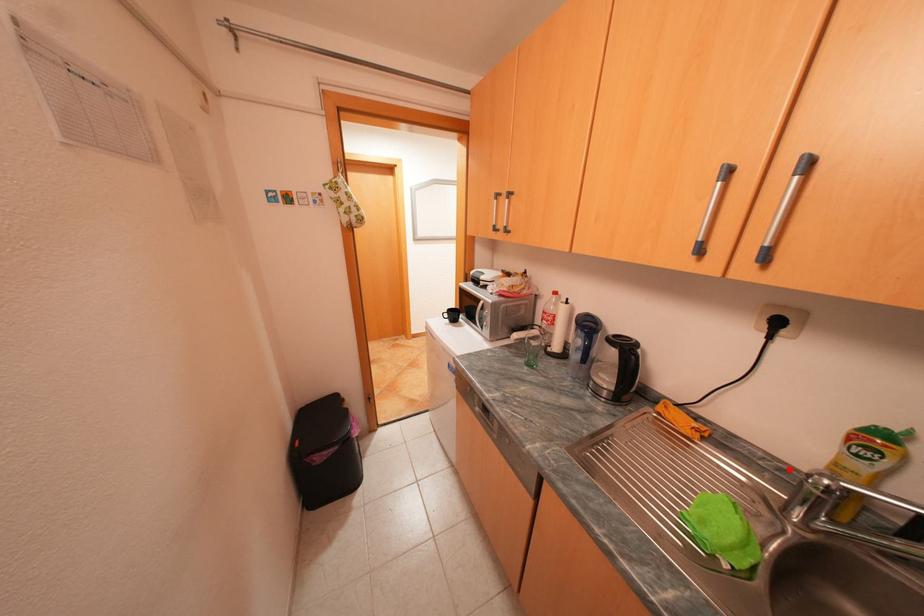
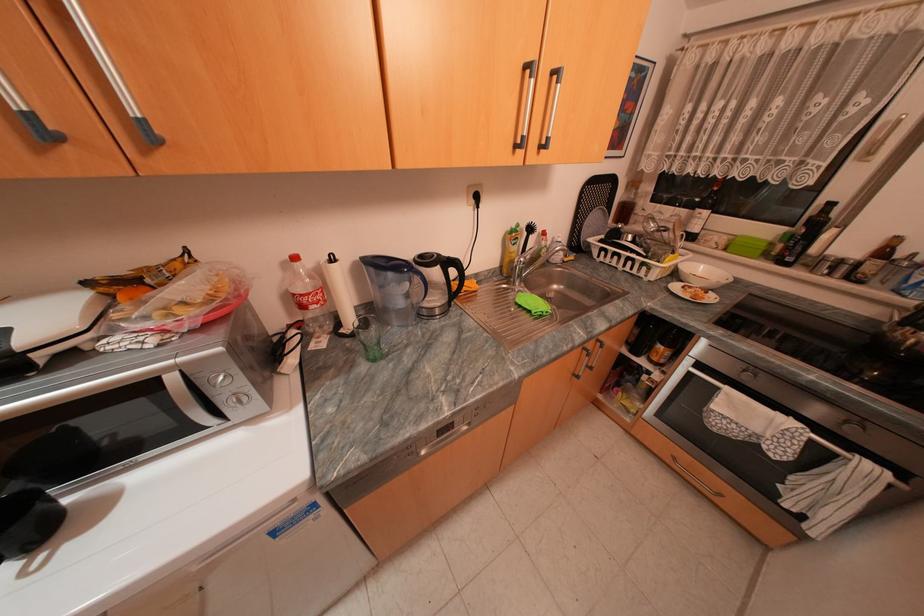
The point at the highlighted location is marked in the first image. Where is the corresponding point in the second image?

(503, 273)